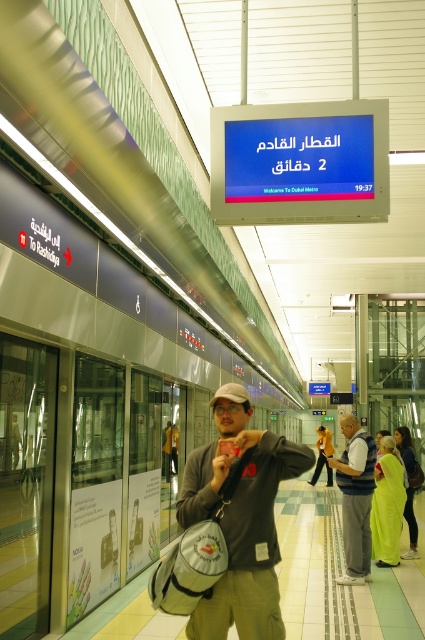
You are a security guard at the Dubai Metro station. You notice a passenger wearing khaki cotton pants at center and gray fabric vest at center. Which clothing item is covering the other?

The khaki cotton pants at center is positioned over gray fabric vest at center, so the pants are covering the vest.

You are a security guard in the Dubai Metro station. You need to locate a passenger wearing khaki cotton pants at center. According to the coordinates provided, where exactly would you find them in the station?

The khaki cotton pants at center is located at the coordinates point (240,518) in the station.